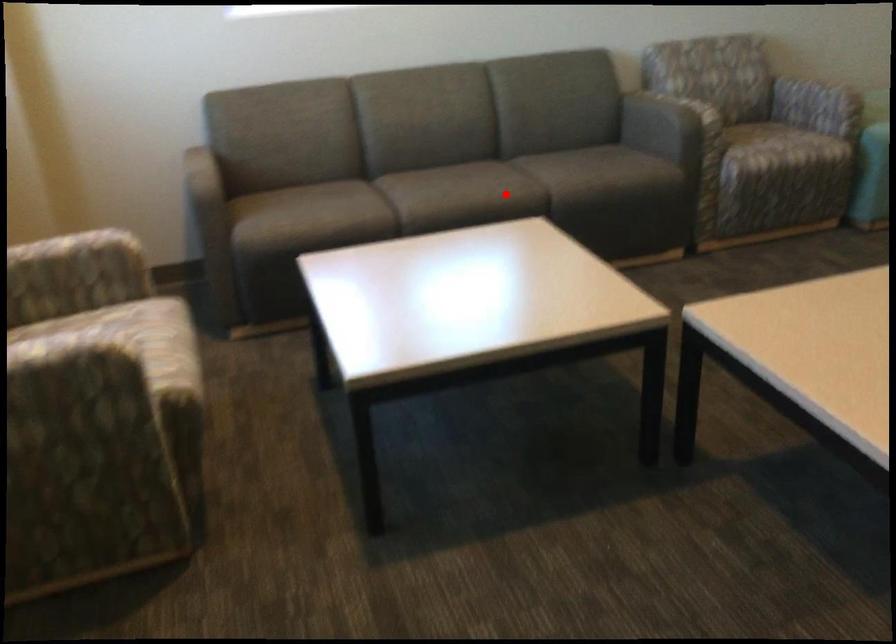
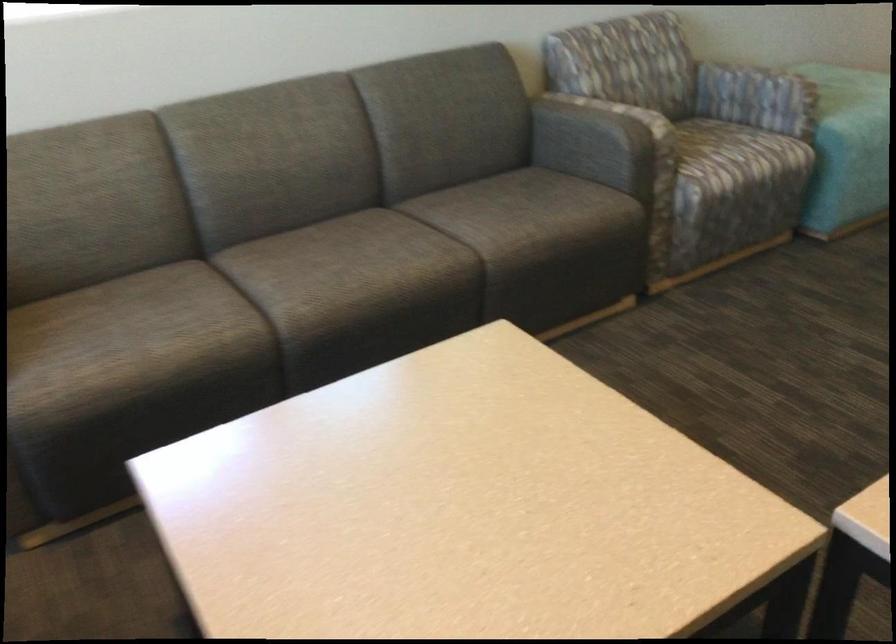
Where in the second image is the point corresponding to the highlighted location from the first image?

(427, 269)